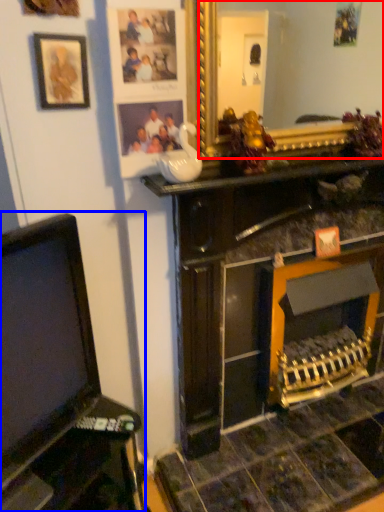
Question: Among these objects, which one is nearest to the camera, mirror (highlighted by a red box) or furniture (highlighted by a blue box)?

Choices:
 (A) mirror
 (B) furniture

Answer: (B)